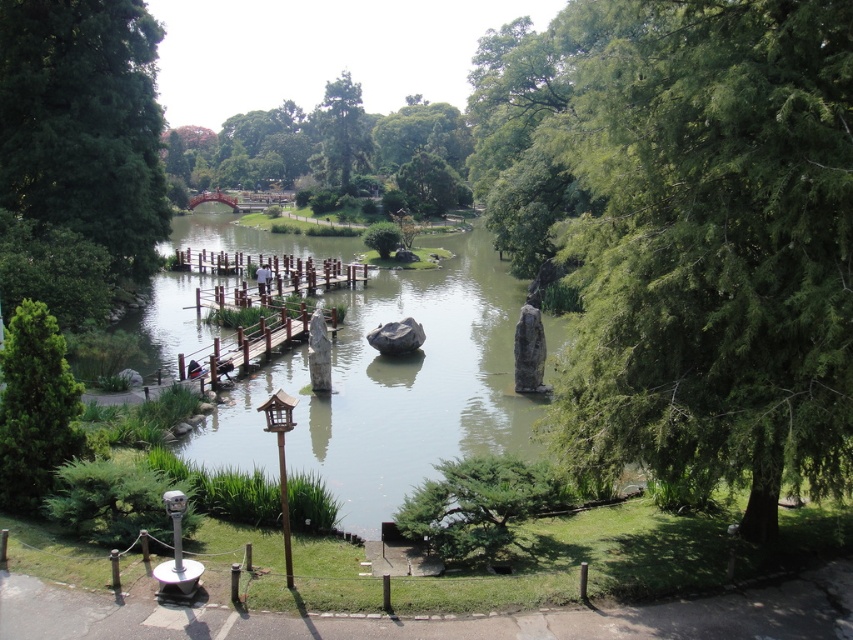
Question: Is wooden dock at center in front of green textured tree at center?

Choices:
 (A) yes
 (B) no

Answer: (A)

Question: Which object is positioned farthest from the green leafy tree at center?

Choices:
 (A) wooden dock at center
 (B) shiny red bridge at center

Answer: (A)

Question: Is green leafy tree at center right to the right of green textured tree at center from the viewer's perspective?

Choices:
 (A) yes
 (B) no

Answer: (A)

Question: Can you confirm if green leafy tree at center is wider than brown wooden dock at center?

Choices:
 (A) no
 (B) yes

Answer: (B)

Question: Which object appears closest to the camera in this image?

Choices:
 (A) green leafy tree at lower left
 (B) green leafy tree at center
 (C) green leafy tree at center right
 (D) wooden dock at center

Answer: (C)

Question: Which point is closer to the camera?

Choices:
 (A) (215, 200)
 (B) (48, 426)

Answer: (B)